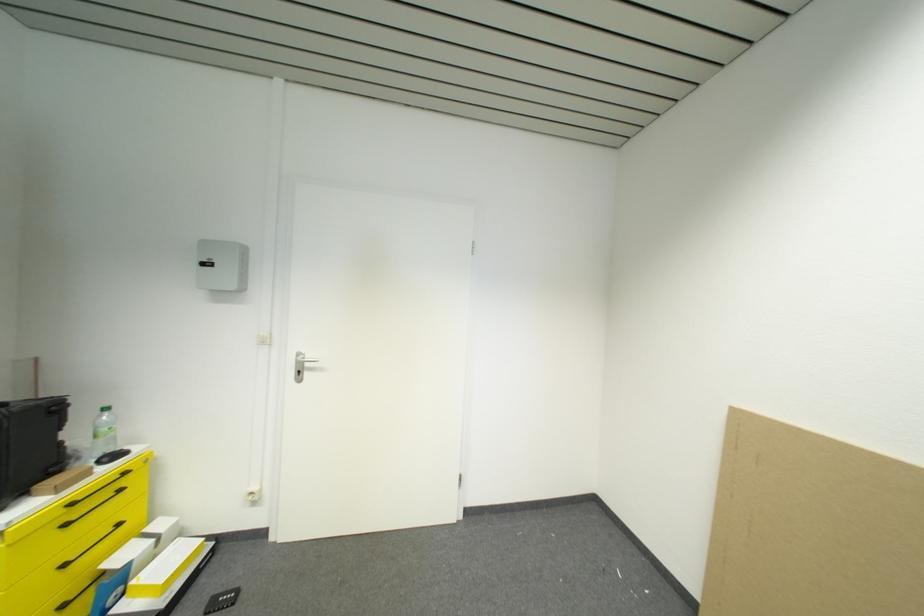
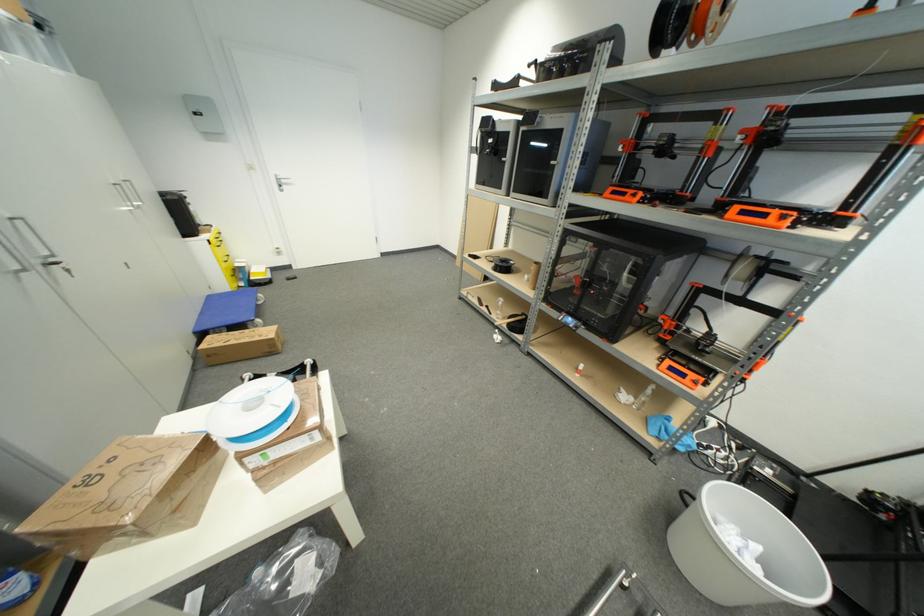
Where in the second image is the point corresponding to the point at 296,376 from the first image?

(281, 188)